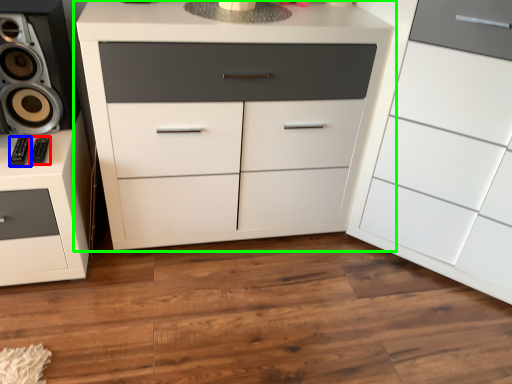
Question: Considering the real-world distances, which object is closest to audio (highlighted by a red box)? audio (highlighted by a blue box) or chest of drawers (highlighted by a green box).

Choices:
 (A) audio
 (B) chest of drawers

Answer: (A)